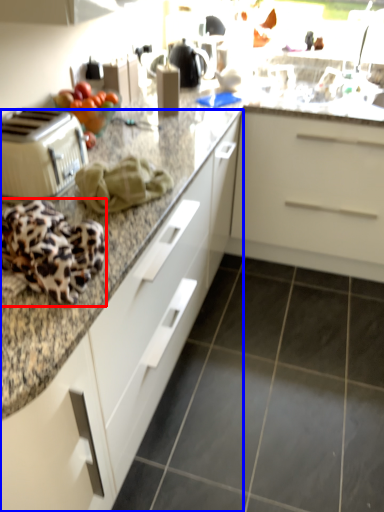
Question: Which object appears farthest to the camera in this image, blanket (highlighted by a red box) or cabinetry (highlighted by a blue box)?

Choices:
 (A) blanket
 (B) cabinetry

Answer: (A)